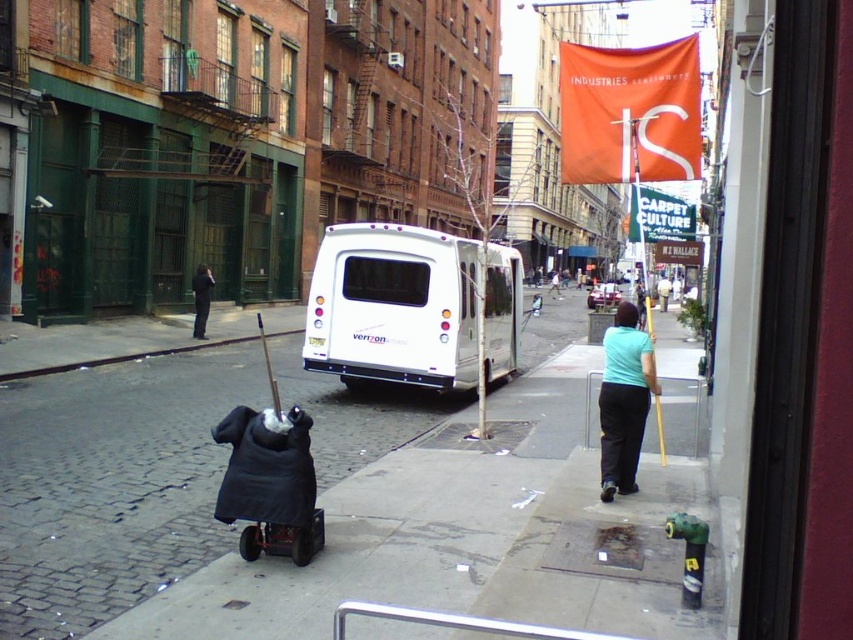
Based on the scene description, where is the white glossy van at center located in terms of coordinates?

The white glossy van at center is located at point coordinates of (x=393, y=307).